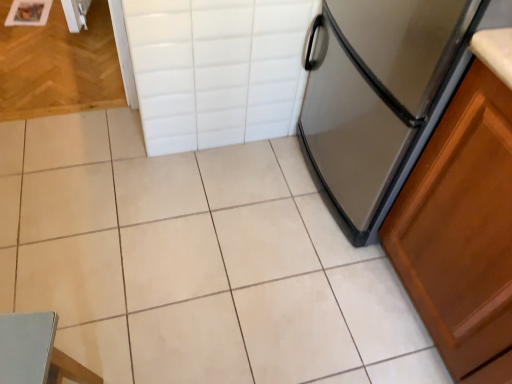
Question: From a real-world perspective, relative to white tile drawer at upper center, is satin silver refrigerator at right vertically above or below?

Choices:
 (A) above
 (B) below

Answer: (A)

Question: In the image, is satin silver refrigerator at right on the left side or the right side of white tile drawer at upper center?

Choices:
 (A) right
 (B) left

Answer: (A)

Question: Estimate the real-world distances between objects in this image. Which object is farther from the light blue fabric chair at lower left?

Choices:
 (A) white tile drawer at upper center
 (B) satin silver refrigerator at right
 (C) white ceramic tile at center

Answer: (B)

Question: Which object is positioned closest to the white ceramic tile at center?

Choices:
 (A) satin silver refrigerator at right
 (B) white tile drawer at upper center
 (C) light blue fabric chair at lower left

Answer: (B)